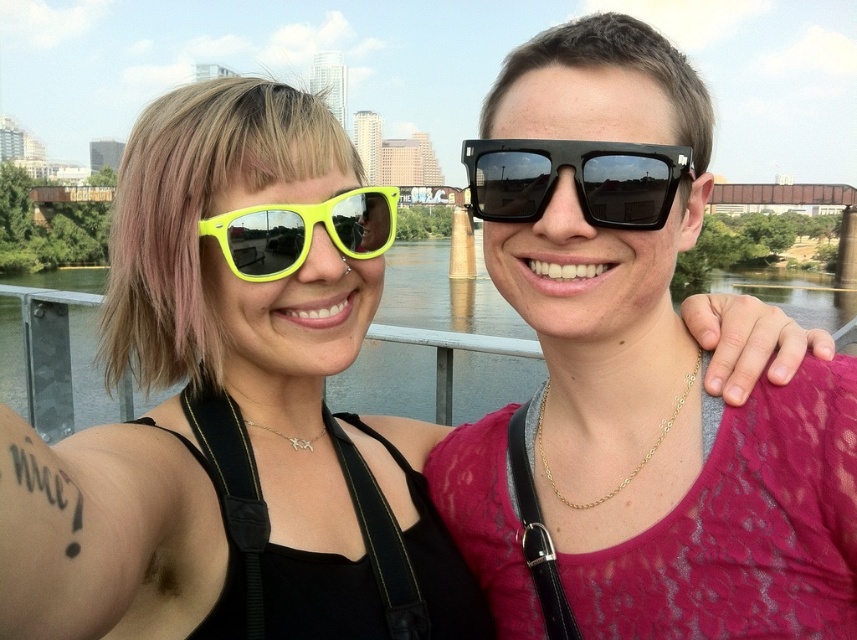
Question: Which of these objects is positioned closest to the greenish water at center?

Choices:
 (A) neon yellow plastic sunglasses at upper left
 (B) neon yellow plastic sunglasses at center
 (C) black reflective sunglasses at center
 (D) matte black sunglasses at center

Answer: (D)

Question: Is greenish water at center above black reflective sunglasses at center?

Choices:
 (A) yes
 (B) no

Answer: (B)

Question: Which point is closer to the camera?

Choices:
 (A) matte black sunglasses at center
 (B) neon yellow plastic sunglasses at center
 (C) greenish water at center

Answer: (A)

Question: Is neon yellow plastic sunglasses at upper left positioned before neon yellow plastic sunglasses at center?

Choices:
 (A) yes
 (B) no

Answer: (A)

Question: Which object is farther from the camera taking this photo?

Choices:
 (A) neon yellow plastic sunglasses at upper left
 (B) neon yellow plastic sunglasses at center
 (C) matte black sunglasses at center

Answer: (B)

Question: In this image, where is black reflective sunglasses at center located relative to neon yellow plastic sunglasses at center?

Choices:
 (A) above
 (B) below

Answer: (A)